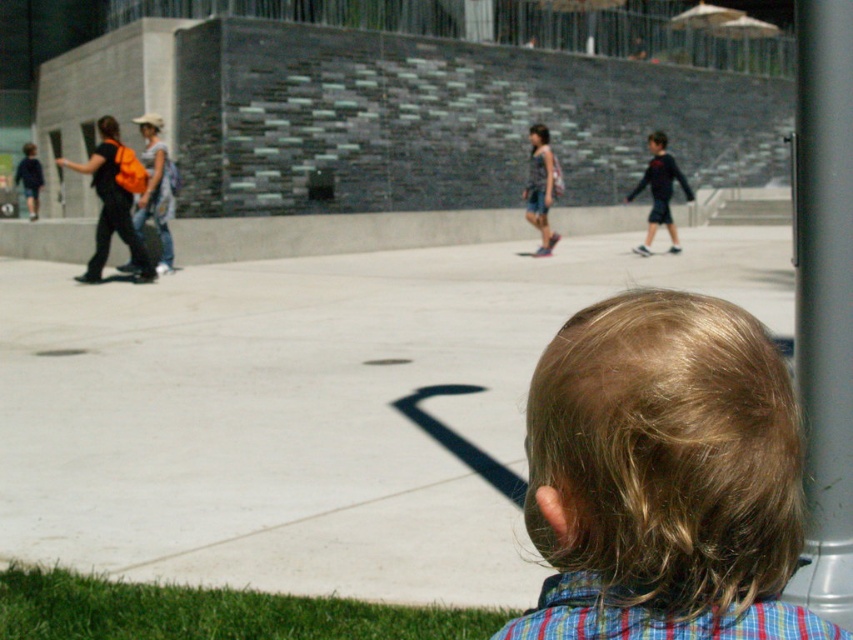
Question: Which of the following is the farthest from the observer?

Choices:
 (A) (222, 492)
 (B) (85, 636)

Answer: (A)

Question: Which point is farther from the camera taking this photo?

Choices:
 (A) (512, 625)
 (B) (445, 637)
 (C) (531, 166)
 (D) (753, 460)

Answer: (C)

Question: Does blonde hair at center have a lesser width compared to green grass at lower left?

Choices:
 (A) yes
 (B) no

Answer: (A)

Question: Does silver metallic pole at center right have a smaller size compared to green grass at lower left?

Choices:
 (A) no
 (B) yes

Answer: (A)

Question: Among these objects, which one is farthest from the camera?

Choices:
 (A) blonde hair at center
 (B) silver metallic pole at center right

Answer: (B)

Question: Does blonde hair at center appear on the right side of plaid cotton shirt at lower right?

Choices:
 (A) yes
 (B) no

Answer: (B)